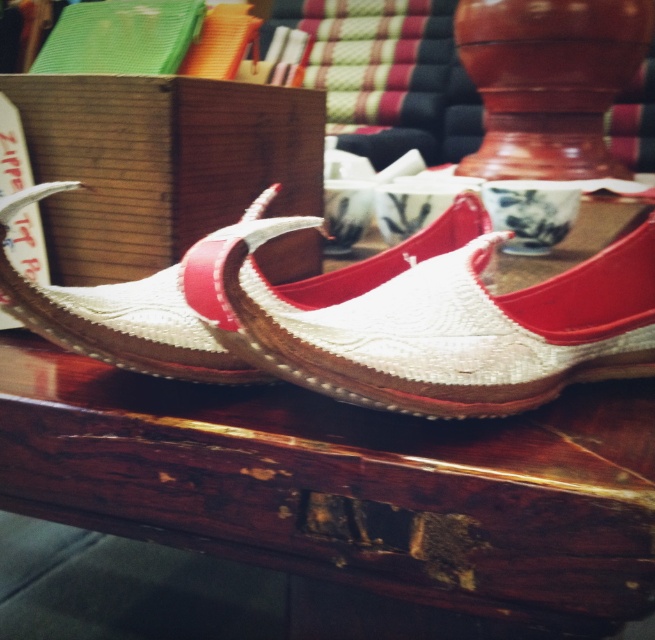
You are organizing items on a wooden surface and need to place a new item at coordinates point 0.5, 0.6. Is there space available at that location given the position of the white woven sandal at center?

The white woven sandal at center is located at point (430, 317), which is very close to the desired coordinates (393, 320). Depending on the size of the new item, there might be limited space. However, since the exact dimensions aren

You are organizing a shoe display and need to place the white woven sandal at center and the woven fabric sandal at center on a shelf. Which sandal should you place first if you want to arrange them from largest to smallest?

The white woven sandal at center should be placed first since it is larger than the woven fabric sandal at center, allowing the arrangement to progress from largest to smallest.

You are standing in a room where the wooden table at center is located at point (348, 484). If you want to place a pair of traditional sandals on the wooden table at center, where should you place them?

You should place the pair of traditional sandals on the wooden table at center located at point 0.759, 0.733.